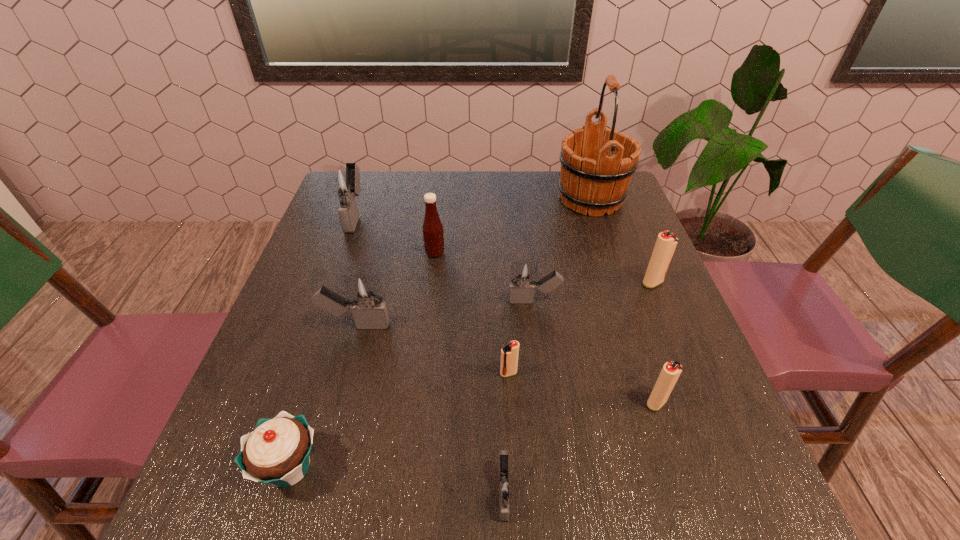
At what (x,y) coordinates should I click in order to perform the action: click on igniter located in the far edge section of the desktop. Please return your answer as a coordinate pair (x, y). Image resolution: width=960 pixels, height=540 pixels. Looking at the image, I should click on (342, 181).

Find the location of a particular element. The height and width of the screenshot is (540, 960). cupcake that is at the near edge is located at coordinates pyautogui.click(x=278, y=450).

At what (x,y) coordinates should I click in order to perform the action: click on igniter situated at the near edge. Please return your answer as a coordinate pair (x, y). The width and height of the screenshot is (960, 540). Looking at the image, I should click on (503, 488).

This screenshot has width=960, height=540. In order to click on cupcake at the left edge in this screenshot , I will do `click(278, 450)`.

I want to click on wine bucket that is at the right edge, so click(593, 178).

The height and width of the screenshot is (540, 960). In order to click on object that is at the far left corner in this screenshot , I will do `click(342, 181)`.

Locate an element on the screen. object at the near left corner is located at coordinates (278, 450).

Identify the location of object located at the far right corner. (593, 178).

Image resolution: width=960 pixels, height=540 pixels. In the image, there is a desktop. What are the coordinates of `vacant space at the far edge` in the screenshot? It's located at (445, 174).

This screenshot has height=540, width=960. In order to click on free location at the left edge of the desktop in this screenshot , I will do `click(343, 348)`.